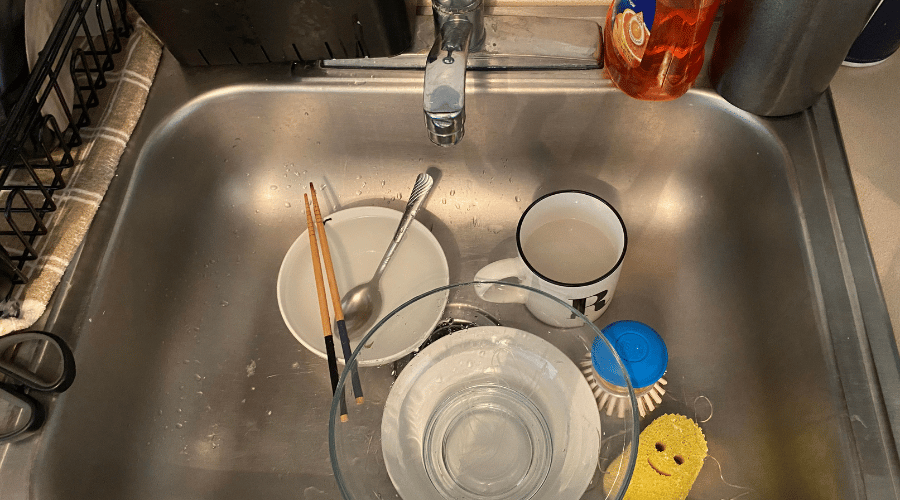
This screenshot has height=500, width=900. What are the coordinates of `sink` in the screenshot? It's located at (736, 322).